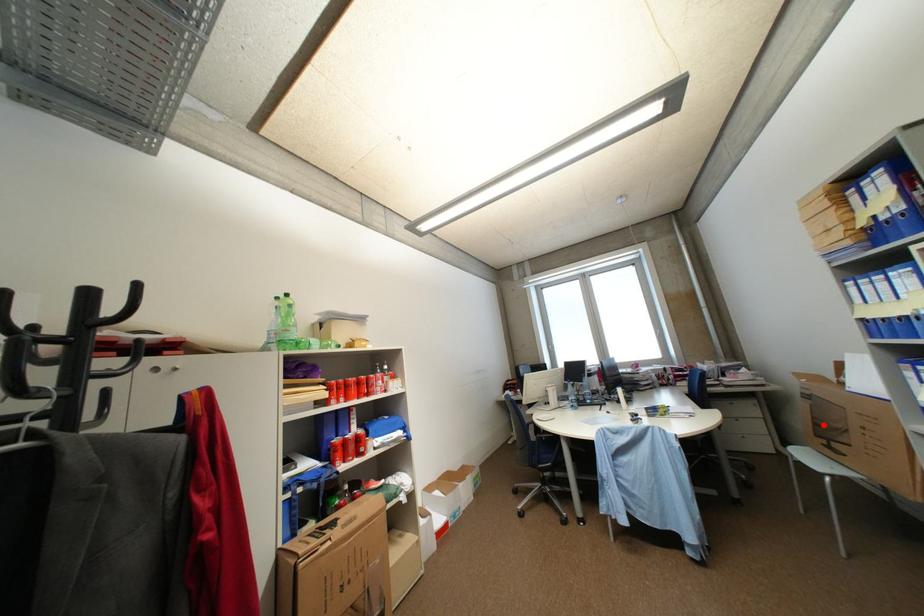
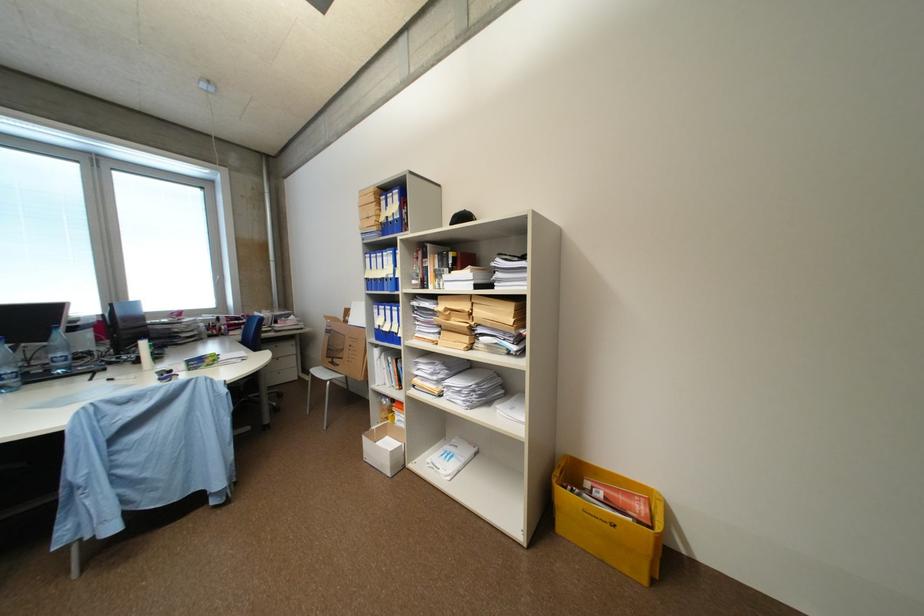
Where in the second image is the point corresponding to the highlighted location from the first image?

(336, 350)